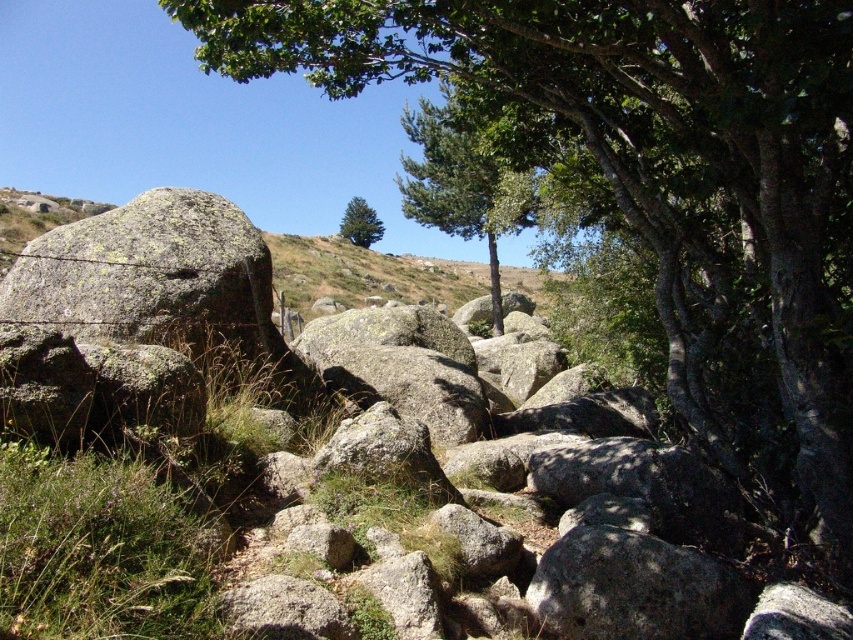
Who is positioned more to the left, gray rough rock at center or green textured tree at center?

Positioned to the left is green textured tree at center.

Which is more to the right, gray rough rock at center or green textured tree at center?

Positioned to the right is gray rough rock at center.

At what (x,y) coordinates should I click in order to perform the action: click on gray rough rock at center. Please return your answer as a coordinate pair (x, y). Looking at the image, I should click on (634, 588).

Find the location of a particular element. gray rough rock at center is located at coordinates (634, 588).

Which is above, gray rough rock at center-left or gray rough rock at center?

gray rough rock at center-left

Does gray rough rock at center-left have a lesser height compared to gray rough rock at center?

In fact, gray rough rock at center-left may be taller than gray rough rock at center.

Does point (134, 301) come behind point (743, 588)?

Yes, it is behind point (743, 588).

Identify the location of gray rough rock at center-left. (213, 259).

Is gray rough rock at center closer to the viewer compared to green leafy tree at center?

Yes, gray rough rock at center is closer to the viewer.

Who is more distant from viewer, [683,616] or [473,182]?

Point [473,182]

Where is `gray rough rock at center`? gray rough rock at center is located at coordinates (634, 588).

Where is `gray rough rock at center`? The height and width of the screenshot is (640, 853). gray rough rock at center is located at coordinates (634, 588).